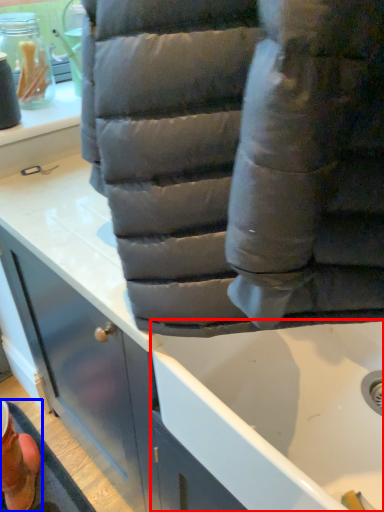
Question: Among these objects, which one is farthest to the camera, bath (highlighted by a red box) or footwear (highlighted by a blue box)?

Choices:
 (A) bath
 (B) footwear

Answer: (B)